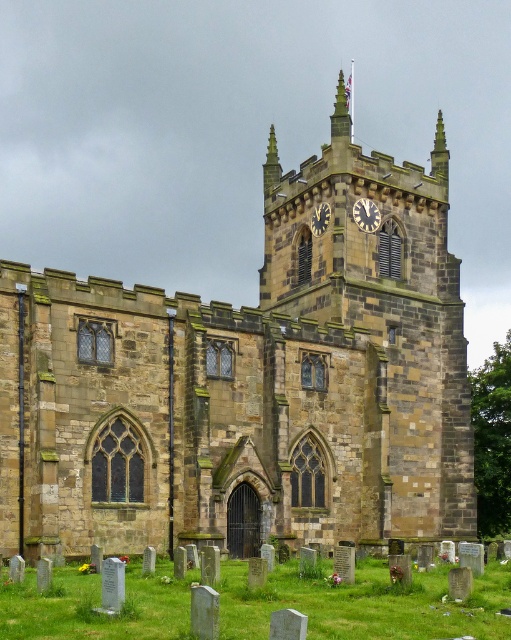
Question: Is metallic clock face at upper center above gold textured clock at upper center?

Choices:
 (A) no
 (B) yes

Answer: (B)

Question: Estimate the real-world distances between objects in this image. Which object is farther from the brown stone clock tower at center?

Choices:
 (A) gold textured clock at upper center
 (B) metallic clock face at upper center

Answer: (A)

Question: Is brown stone clock tower at center wider than metallic clock face at upper center?

Choices:
 (A) yes
 (B) no

Answer: (A)

Question: Which of the following is the closest to the observer?

Choices:
 (A) metallic clock face at upper center
 (B) brown stone clock tower at center

Answer: (B)

Question: Which is nearer to the gold textured clock at upper center?

Choices:
 (A) metallic clock face at upper center
 (B) brown stone clock tower at center

Answer: (A)

Question: Can you confirm if brown stone clock tower at center is wider than gold textured clock at upper center?

Choices:
 (A) yes
 (B) no

Answer: (A)